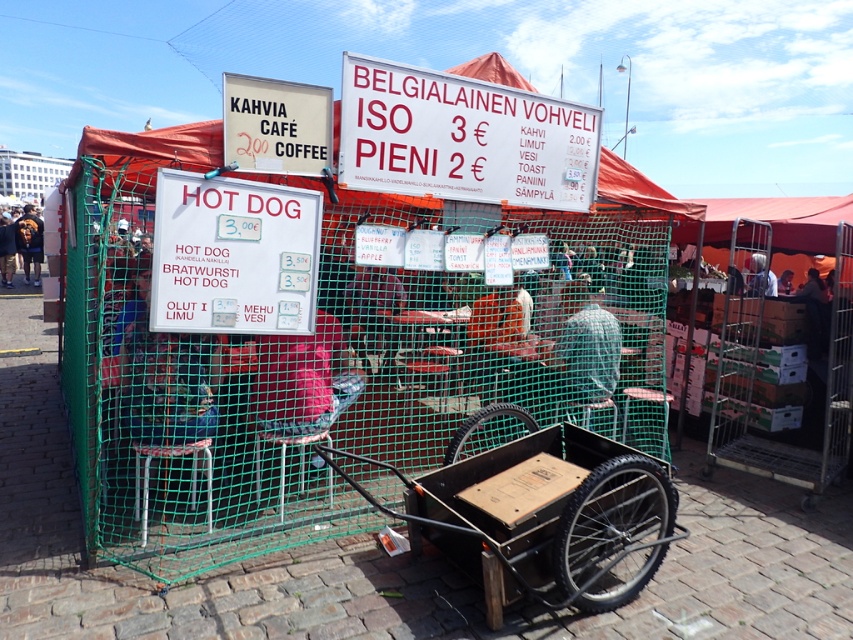
Does white plastic sign at upper center have a lesser height compared to white paper sign at center?

No.

Does white plastic sign at upper center have a smaller size compared to white paper sign at center?

No, white plastic sign at upper center is not smaller than white paper sign at center.

This screenshot has width=853, height=640. What do you see at coordinates (463, 138) in the screenshot?
I see `white plastic sign at upper center` at bounding box center [463, 138].

At what (x,y) coordinates should I click in order to perform the action: click on white plastic sign at upper center. Please return your answer as a coordinate pair (x, y). Looking at the image, I should click on (463, 138).

Can you confirm if wooden cart at lower center is positioned to the left of white paper sign at center?

In fact, wooden cart at lower center is to the right of white paper sign at center.

Can you confirm if wooden cart at lower center is positioned above white paper sign at center?

No.

The width and height of the screenshot is (853, 640). What do you see at coordinates (541, 509) in the screenshot?
I see `wooden cart at lower center` at bounding box center [541, 509].

The height and width of the screenshot is (640, 853). In order to click on wooden cart at lower center in this screenshot , I will do `click(541, 509)`.

Between wooden cart at lower center and white plastic sign at upper center, which one has more height?

wooden cart at lower center

Is wooden cart at lower center further to camera compared to white plastic sign at upper center?

No, it is in front of white plastic sign at upper center.

Which is in front, point (572, 481) or point (498, 115)?

Positioned in front is point (572, 481).

What are the coordinates of `wooden cart at lower center` in the screenshot? It's located at [x=541, y=509].